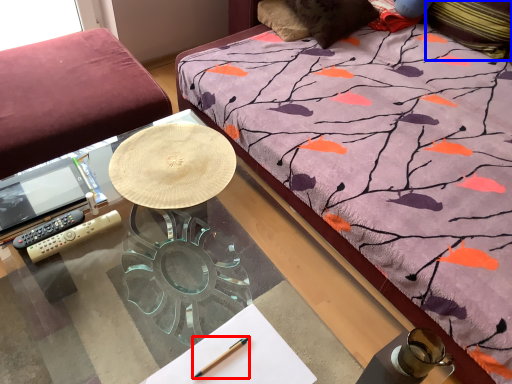
Question: Which object appears closest to the camera in this image, pen (highlighted by a red box) or pillow (highlighted by a blue box)?

Choices:
 (A) pen
 (B) pillow

Answer: (A)